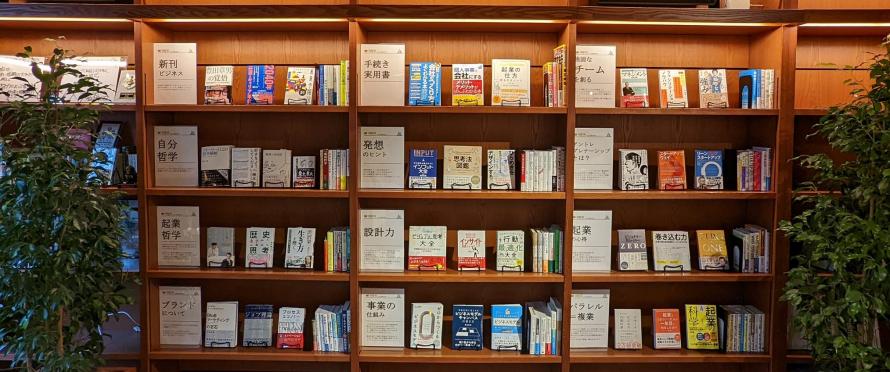
You are a GUI agent. You are given a task and a screenshot of the screen. Output one action in this format:
    pyautogui.click(x=<x>, y=<y>)
    Task: Click on the center shelf divider up and down
    Image resolution: width=890 pixels, height=372 pixels.
    Given the screenshot: What is the action you would take?
    pyautogui.click(x=139, y=78), pyautogui.click(x=352, y=122), pyautogui.click(x=572, y=133), pyautogui.click(x=789, y=127)